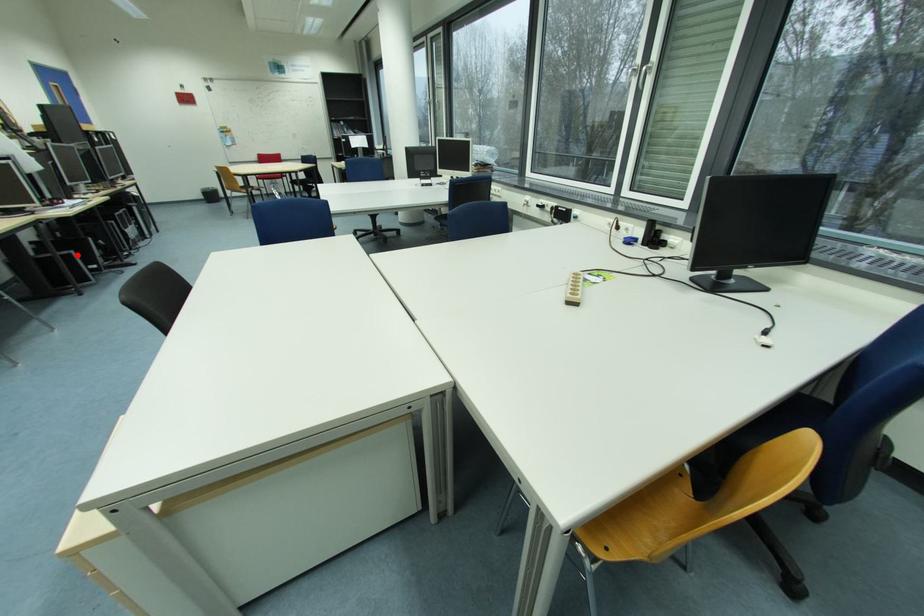
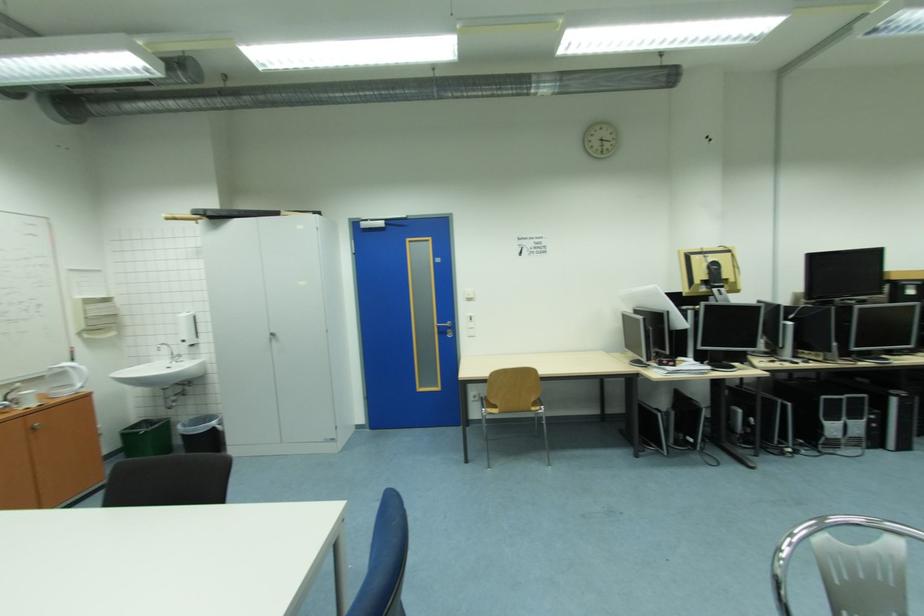
Locate, in the second image, the point that corresponds to the highlighted location in the first image.

(663, 416)